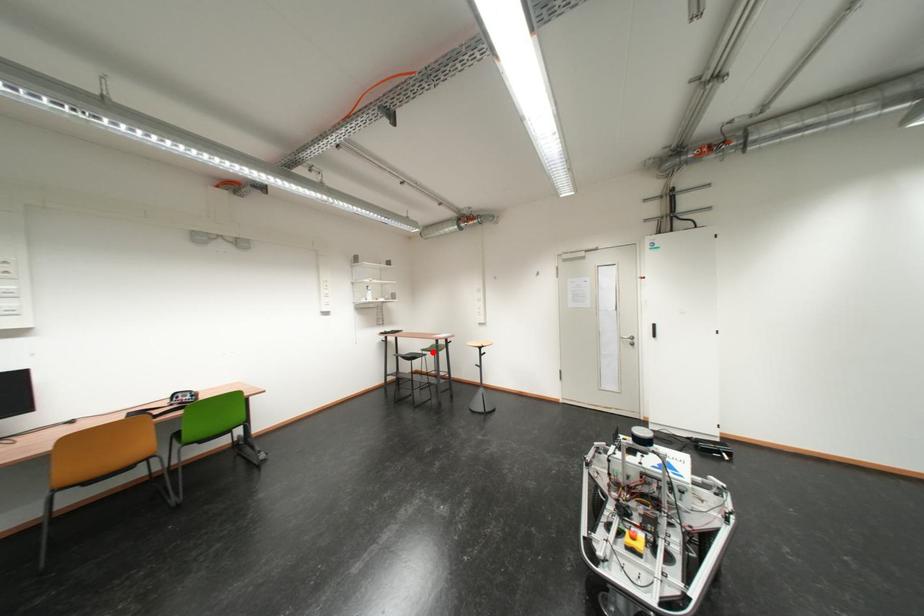
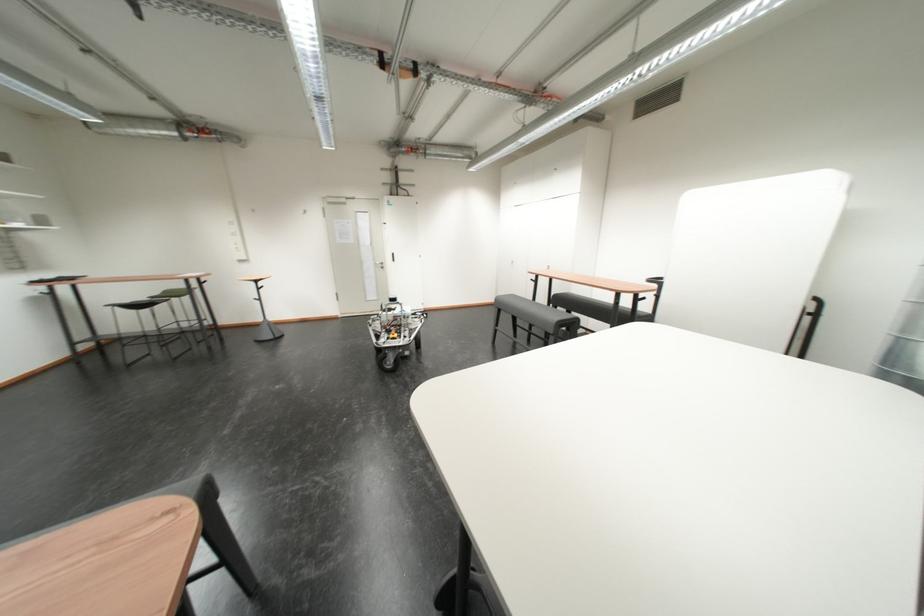
Question: I am providing you with two images of the same scene from different viewpoints. In image1, a red point is highlighted. Considering the same 3D point in image2, which of the following is correct?

Choices:
 (A) It is closer
 (B) It is farther

Answer: (A)